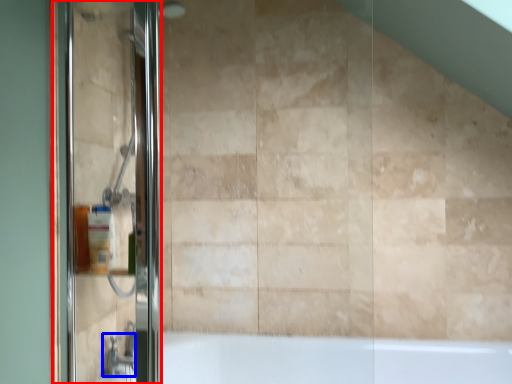
Question: Which of the following is the farthest to the observer, screen door (highlighted by a red box) or faucet (highlighted by a blue box)?

Choices:
 (A) screen door
 (B) faucet

Answer: (B)